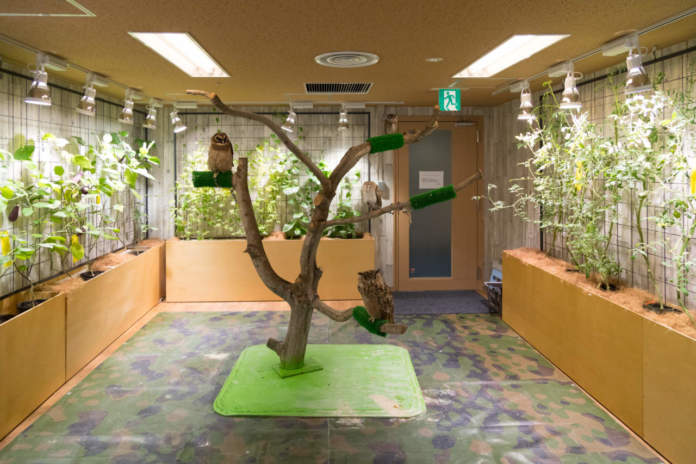
Image resolution: width=696 pixels, height=464 pixels. In order to click on door in this screenshot , I will do `click(461, 229)`.